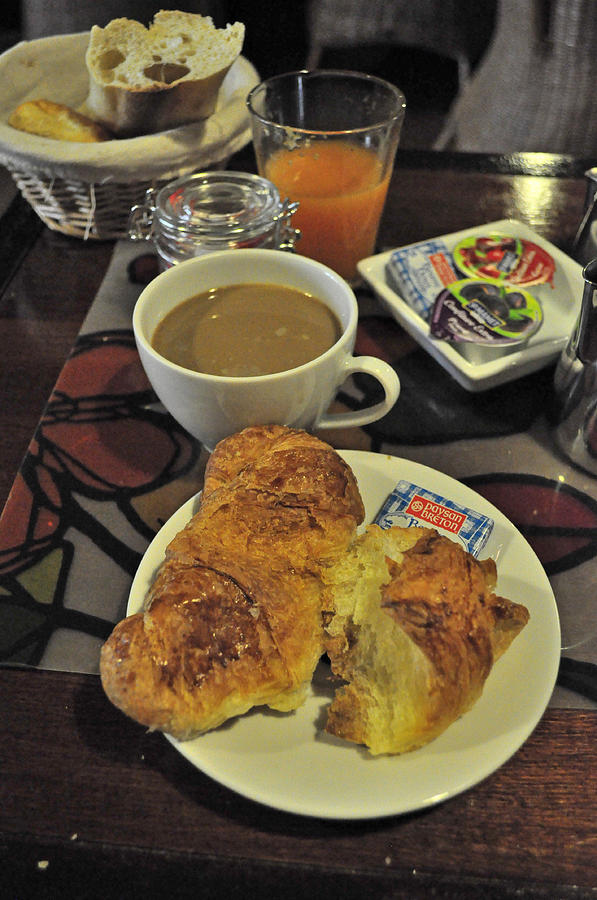
You are a GUI agent. You are given a task and a screenshot of the screen. Output one action in this format:
    pyautogui.click(x=<x>, y=<y>)
    Task: Click on the brighter section of the table
    The image size is (597, 900).
    Given the screenshot: What is the action you would take?
    pyautogui.click(x=572, y=774)